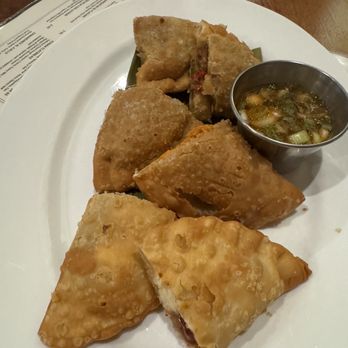
You are a GUI agent. You are given a task and a screenshot of the screen. Output one action in this format:
    pyautogui.click(x=<x>, y=<y>)
    Task: Click on the silver sauce container
    The width and height of the screenshot is (348, 348).
    Given the screenshot: What is the action you would take?
    pyautogui.click(x=293, y=150), pyautogui.click(x=317, y=326)